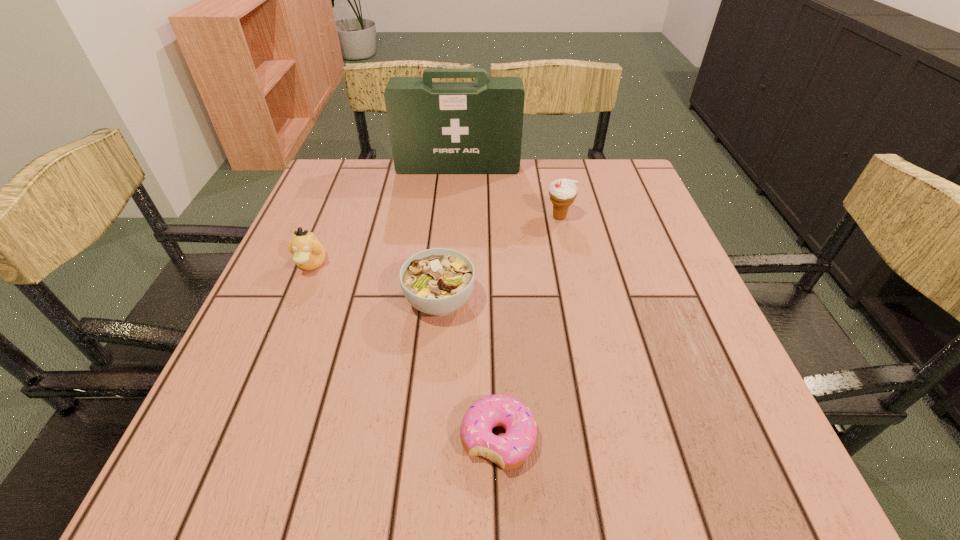
I want to click on free space that satisfies the following two spatial constraints: 1. on the face of the soup bowl; 2. on the left side of the duckling, so click(x=296, y=301).